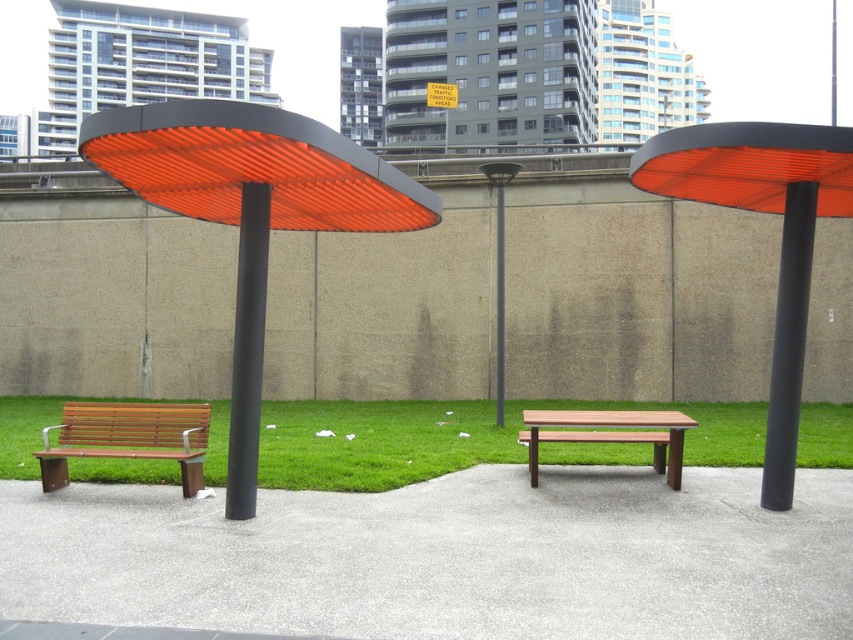
Can you confirm if green grass at lower center is positioned to the right of black matte pole at right?

Incorrect, green grass at lower center is not on the right side of black matte pole at right.

Who is higher up, green grass at lower center or black matte pole at right?

black matte pole at right is above.

Does point (402, 481) come behind point (802, 266)?

Yes.

In order to click on green grass at lower center in this screenshot , I will do [453, 438].

Does green grass at lower center appear over orange matte umbrella at right?

No.

Which is behind, point (318, 420) or point (830, 140)?

The point (318, 420) is behind.

I want to click on green grass at lower center, so click(x=453, y=438).

This screenshot has height=640, width=853. In order to click on orange corrugated plastic umbrella at left in this screenshot , I will do `click(251, 211)`.

Can you confirm if orange corrugated plastic umbrella at left is positioned above black metal pole at center?

Actually, orange corrugated plastic umbrella at left is below black metal pole at center.

Who is more distant from viewer, (171, 122) or (502, 365)?

Point (502, 365)

The width and height of the screenshot is (853, 640). Find the location of `orange corrugated plastic umbrella at left`. orange corrugated plastic umbrella at left is located at coordinates (251, 211).